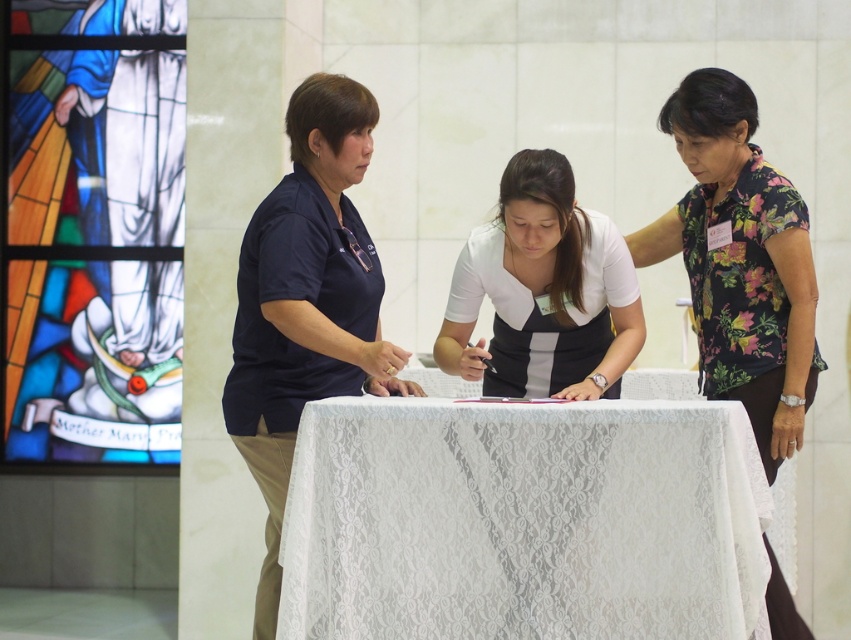
You are a photographer setting up for a group photo at the table. The white lace tablecloth at center and floral print blouse at center are important elements you want to capture. Can you fit both in the frame if your camera has a maximum field of view of 30 inches?

The white lace tablecloth at center and floral print blouse at center are 32.48 inches apart from each other. Since the distance between them exceeds the camera field of view of 30 inches, you cannot fit both in the frame.

You are a photographer setting up for a formal event. The table has a white lace tablecloth at center and a floral print blouse at center. Which object is wider?

The white lace tablecloth at center is wider than the floral print blouse at center.